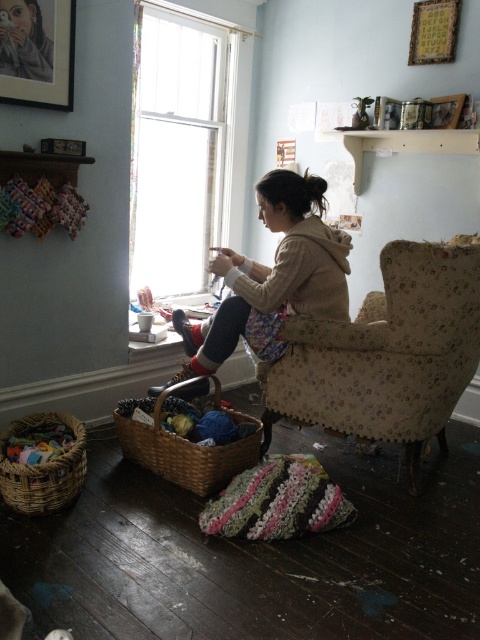
You are organizing a small shelf in the room and need to place the woven brown basket at lower left and the wooden picture frame at upper right. Which object should you place lower on the shelf to ensure stability?

The woven brown basket at lower left should be placed lower on the shelf since it is shorter than the wooden picture frame at upper right, allowing for better stability.

You are standing in the room and want to place a small potted plant on the windowsill. The windowsill is located at point (180, 145). Where exactly should you place the plant?

The white glass window at upper center is located at point (180, 145), so you should place the plant on the windowsill near the white glass window at upper center.

You are a delivery person who needs to place a small package on the woven brown basket at lower center. The package is 1 foot in length. You are standing at the white glass window at upper center. Can you reach the basket without moving your position?

The white glass window at upper center is 5.16 feet away from the woven brown basket at lower center. Since the distance between them is greater than the 1 foot length of the package, you cannot reach the basket from your current position at the window.